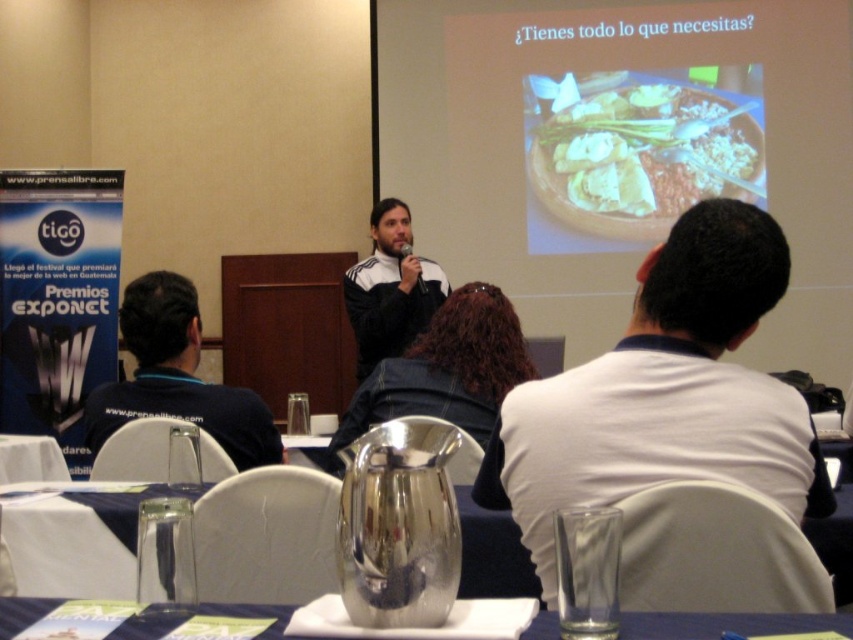
You are organizing a conference and need to ensure that the dark blue shirt at left and the metallic silver pitcher at center are visible to all attendees. Based on their sizes, which object might be more easily seen from the back rows?

The dark blue shirt at left has a larger size compared to the metallic silver pitcher at center, so it would be more easily seen from the back rows.

You are an event organizer who needs to adjust the seating arrangement. The podium where the man is standing has a width of 1.5 meters. Can the brown matte plate at upper center and the white fleece jacket at center be placed on the podium without overlapping?

The brown matte plate at upper center is 1.71 meters from the white fleece jacket at center. Since the podium is only 1.5 meters wide, placing both items on the podium would cause them to overlap as the distance between them exceeds the podium width.

You are organizing a conference and need to ensure that the dark blue shirt at left and the metallic silver pitcher at center are visible to all attendees. Considering their sizes, which object might require moving closer to the front for better visibility?

The dark blue shirt at left has a larger width than the metallic silver pitcher at center, so it might need to be moved closer to the front to ensure it is visible to all attendees.